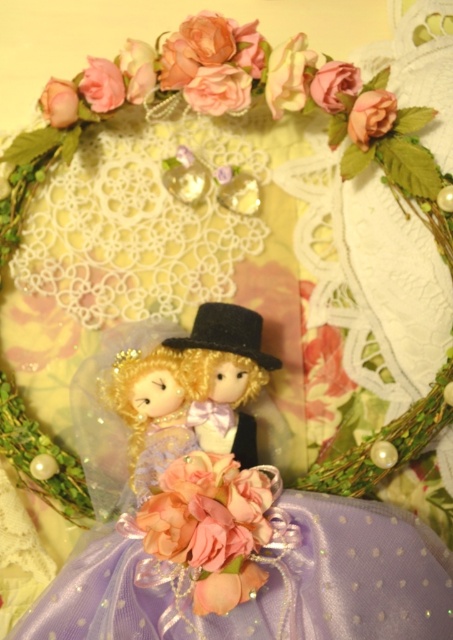
You are standing 40 inches away from the image. The satin black top hat at center is part of the displayed doll. Can you reach it if you extend your hand forward by 3 inches?

The satin black top hat at center is 37.12 inches away from the viewer. Since you are standing 40 inches away and can extend your hand by 3 inches, your total reach would be 43 inches. This is 5.88 inches beyond the hat, so you can reach it.

You are a florist arranging a bouquet for a client. You have a pink satin flower at center and a matte purple fabric doll at center. The client wants to know which item takes up more space in the arrangement. Which one should you mention?

The pink satin flower at center occupies less space than matte purple fabric doll at center, so the florist should mention that the matte purple fabric doll at center takes up more space.